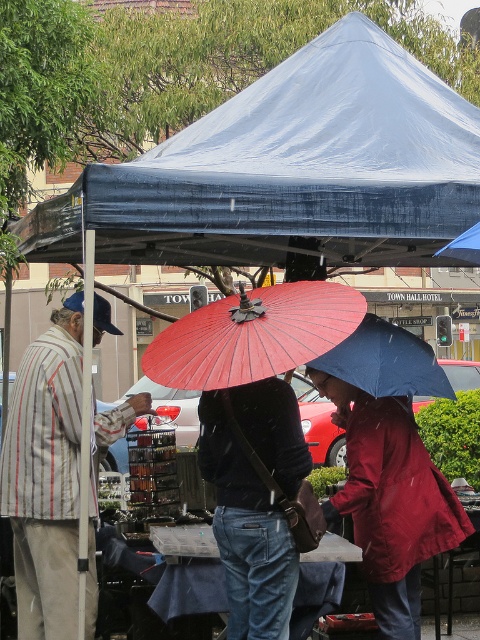
You are standing at the entrance of the market and want to walk towards the striped fabric jacket at left. Is the white matte canopy at upper center blocking your path?

The white matte canopy at upper center is further to the viewer than the striped fabric jacket at left, so it is closer to you. This means the canopy is not blocking your path to the striped fabric jacket at left since it is already in front of the canopy.